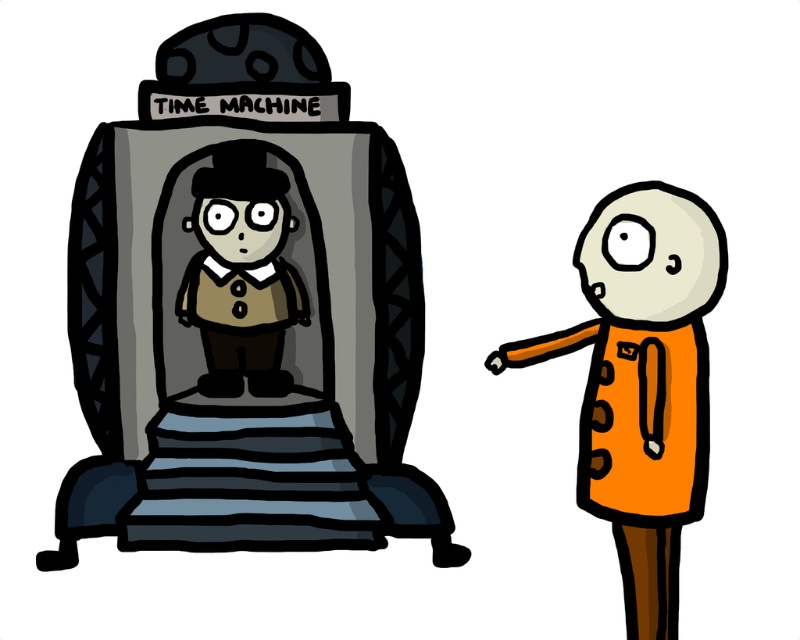
Question: Is matte gray time machine at center to the left of orange fabric coat at right from the viewer's perspective?

Choices:
 (A) no
 (B) yes

Answer: (B)

Question: Which object is the farthest from the matte gray time machine at center?

Choices:
 (A) orange fabric coat at right
 (B) matte brown suit at center

Answer: (A)

Question: Observing the image, what is the correct spatial positioning of orange fabric coat at right in reference to matte brown suit at center?

Choices:
 (A) left
 (B) right

Answer: (B)

Question: Can you confirm if orange fabric coat at right is positioned below matte brown suit at center?

Choices:
 (A) no
 (B) yes

Answer: (B)

Question: Which of the following is the closest to the observer?

Choices:
 (A) matte brown suit at center
 (B) matte gray time machine at center

Answer: (B)

Question: Among these points, which one is farthest from the camera?

Choices:
 (A) (666, 515)
 (B) (341, 502)
 (C) (262, 257)

Answer: (C)